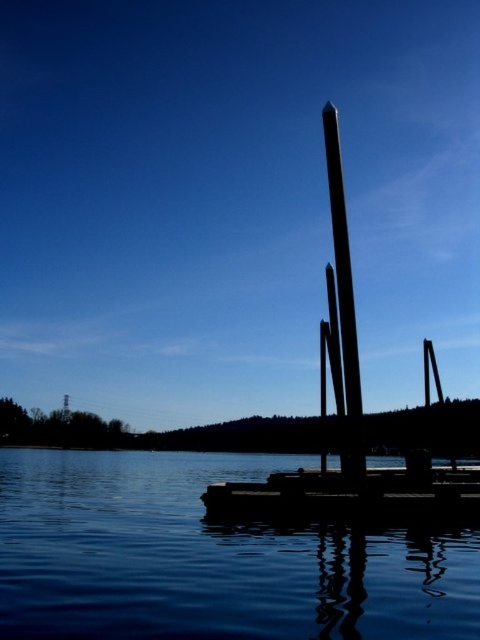
Question: Does transparent water at center have a smaller size compared to smooth wood dock at center?

Choices:
 (A) yes
 (B) no

Answer: (B)

Question: Does transparent water at center come behind smooth wood dock at center?

Choices:
 (A) no
 (B) yes

Answer: (A)

Question: In this image, where is transparent water at center located relative to black polished pole at center?

Choices:
 (A) right
 (B) left

Answer: (B)

Question: Based on their relative distances, which object is farther from the smooth wood dock at center?

Choices:
 (A) transparent water at center
 (B) black polished pole at center

Answer: (A)

Question: Which point appears farthest from the camera in this image?

Choices:
 (A) (479, 486)
 (B) (324, 115)
 (C) (181, 540)

Answer: (A)

Question: Which object is the farthest from the smooth wood dock at center?

Choices:
 (A) black polished pole at center
 (B) transparent water at center

Answer: (B)